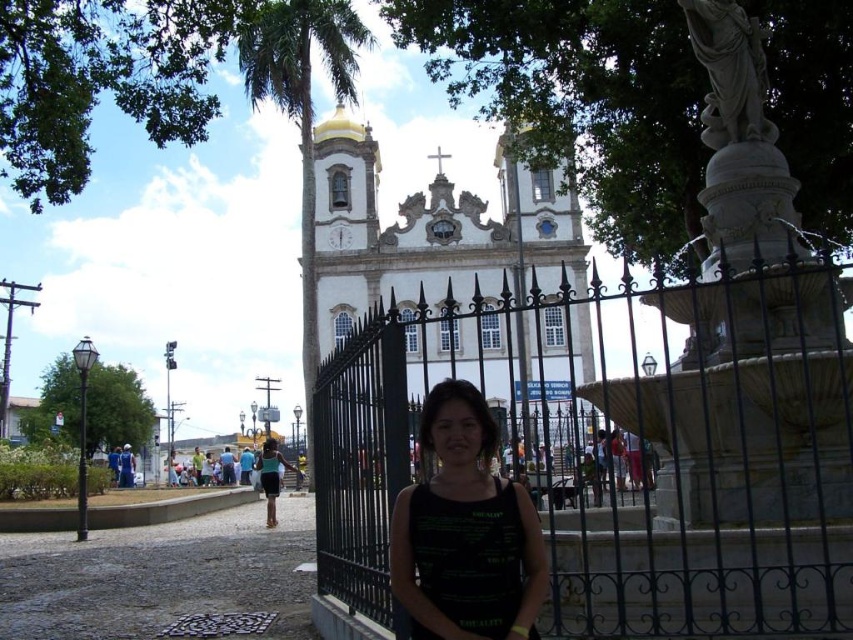
Does white stone church at center appear under green leafy palm tree at center?

Indeed, white stone church at center is positioned under green leafy palm tree at center.

Based on the photo, is white stone church at center taller than green leafy palm tree at center?

No.

The image size is (853, 640). What do you see at coordinates (444, 259) in the screenshot? I see `white stone church at center` at bounding box center [444, 259].

The image size is (853, 640). Identify the location of white stone church at center. click(444, 259).

Describe the element at coordinates (465, 531) in the screenshot. This screenshot has height=640, width=853. I see `black matte tank top at center` at that location.

Is black matte tank top at center to the right of green leafy palm tree at center from the viewer's perspective?

Yes, black matte tank top at center is to the right of green leafy palm tree at center.

The width and height of the screenshot is (853, 640). What are the coordinates of `black matte tank top at center` in the screenshot? It's located at (465, 531).

I want to click on black matte tank top at center, so click(465, 531).

Which of these two, black matte tank top at center or matte black tank top at center, stands taller?

black matte tank top at center is taller.

Measure the distance between point (485,548) and camera.

They are 317.81 feet apart.

What are the coordinates of `black matte tank top at center` in the screenshot? It's located at (465, 531).